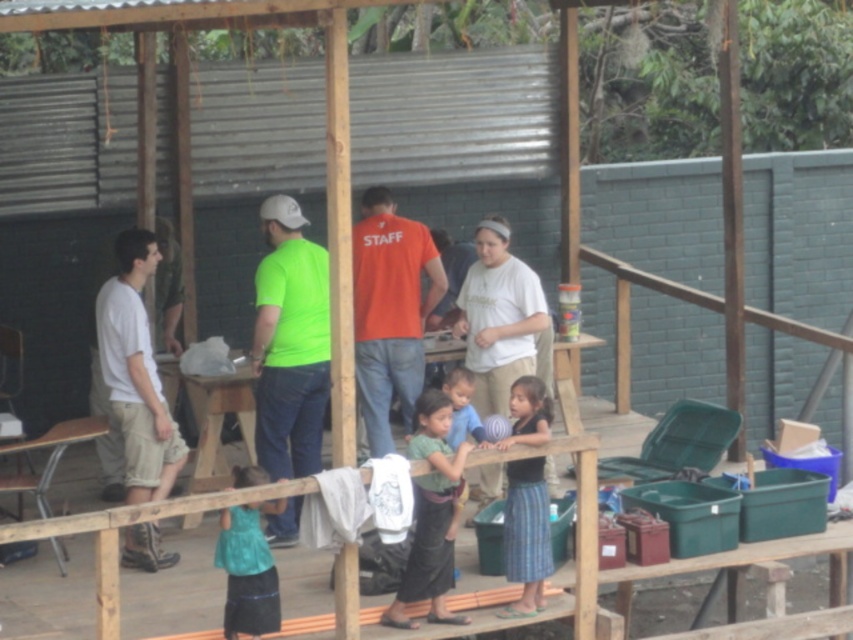
Question: Which object appears farthest from the camera in this image?

Choices:
 (A) orange matte shirt at center
 (B) matte green shirt at center
 (C) green woven skirt at center

Answer: (B)

Question: Is orange matte shirt at center bigger than white cotton shirt at left?

Choices:
 (A) no
 (B) yes

Answer: (B)

Question: Can you confirm if orange matte shirt at center is positioned above teal fabric skirt at lower center?

Choices:
 (A) yes
 (B) no

Answer: (A)

Question: Which object is positioned closest to the teal fabric skirt at lower center?

Choices:
 (A) matte green shirt at center
 (B) white cotton shirt at left
 (C) blue woven skirt at lower right
 (D) green woven skirt at center

Answer: (D)

Question: Is neon green t-shirt at center positioned at the back of blue woven skirt at lower right?

Choices:
 (A) no
 (B) yes

Answer: (B)

Question: Which point is closer to the camera?

Choices:
 (A) (433, 589)
 (B) (152, 432)
 (C) (306, 442)

Answer: (A)